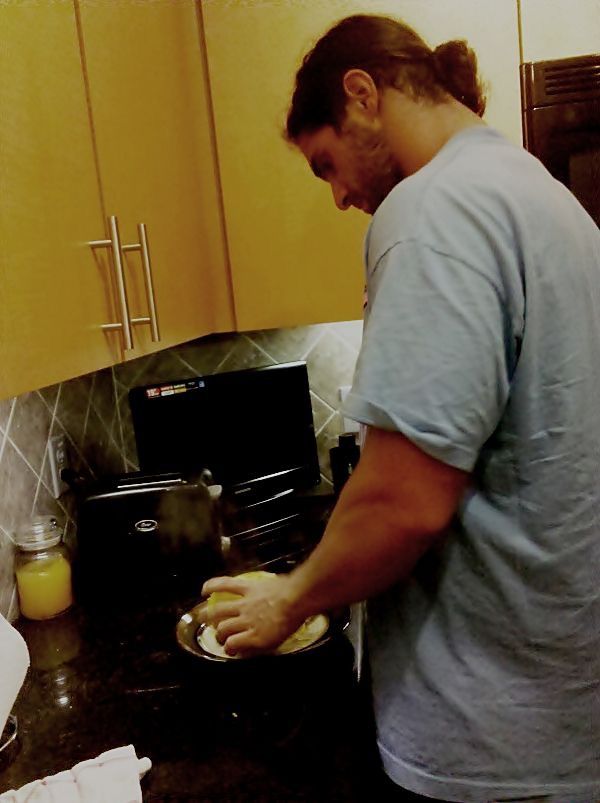
Locate an element on the screen. The height and width of the screenshot is (803, 600). white wall is located at coordinates (484, 26).